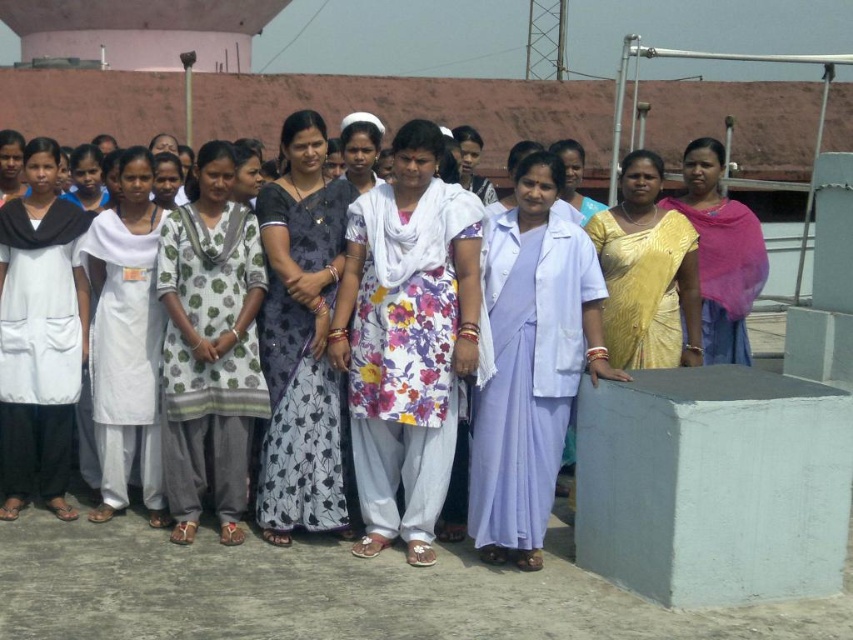
Does dark blue floral saree at center lie in front of white cotton kurta at center?

Yes, dark blue floral saree at center is in front of white cotton kurta at center.

At what (x,y) coordinates should I click in order to perform the action: click on dark blue floral saree at center. Please return your answer as a coordinate pair (x, y). The height and width of the screenshot is (640, 853). Looking at the image, I should click on (300, 339).

Which is behind, point (561, 172) or point (202, 470)?

The point (561, 172) is more distant.

Which is below, light purple silk saree at center or floral cotton kurta at center?

Positioned lower is light purple silk saree at center.

Which is behind, point (564, 416) or point (227, 282)?

Positioned behind is point (227, 282).

The height and width of the screenshot is (640, 853). Identify the location of light purple silk saree at center. (531, 364).

Is white cotton dress at center taller than white cotton kurta at center?

Yes, white cotton dress at center is taller than white cotton kurta at center.

Is white cotton dress at center to the right of white cotton kurta at center from the viewer's perspective?

Incorrect, white cotton dress at center is not on the right side of white cotton kurta at center.

Measure the distance between point (78, 372) and camera.

Point (78, 372) and camera are 26.90 meters apart.

Where is `white cotton dress at center`? white cotton dress at center is located at coordinates (39, 336).